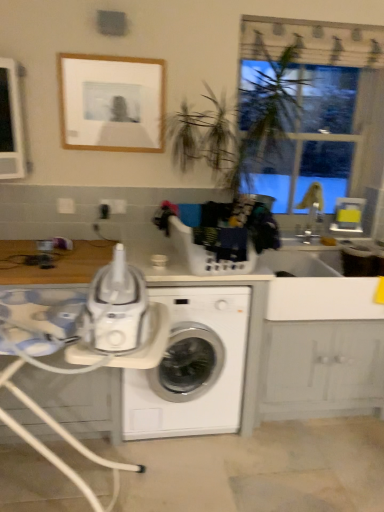
Locate an element on the screen. white plastic tray at center is located at coordinates (258, 352).

What do you see at coordinates (111, 103) in the screenshot? I see `wooden frame at upper center` at bounding box center [111, 103].

Locate an element on the screen. This screenshot has width=384, height=512. white plastic tray at center is located at coordinates (258, 352).

Who is smaller, white glossy washing machine at center or transparent plastic window screen at upper right?

Smaller between the two is transparent plastic window screen at upper right.

Which is more to the left, white glossy washing machine at center or transparent plastic window screen at upper right?

Positioned to the left is white glossy washing machine at center.

Which is correct: white glossy washing machine at center is inside transparent plastic window screen at upper right, or outside of it?

white glossy washing machine at center lies outside transparent plastic window screen at upper right.

In terms of width, does white glossy washing machine at center look wider or thinner when compared to transparent plastic window screen at upper right?

white glossy washing machine at center is wider than transparent plastic window screen at upper right.

Is wooden frame at upper center at the left side of white plastic tray at center?

Correct, you'll find wooden frame at upper center to the left of white plastic tray at center.

From a real-world perspective, which object rests below the other?

white plastic tray at center, from a real-world perspective.

Considering the positions of points (143, 137) and (136, 369), is point (143, 137) farther from camera compared to point (136, 369)?

Yes, point (143, 137) is farther from viewer.

Does wooden frame at upper center come in front of white plastic tray at center?

No.

From the image's perspective, is white plastic table at lower left above wooden frame at upper center?

Actually, white plastic table at lower left appears below wooden frame at upper center in the image.

How distant is white plastic table at lower left from wooden frame at upper center?

white plastic table at lower left and wooden frame at upper center are 1.37 meters apart.

Which object is wider, white plastic table at lower left or wooden frame at upper center?

With larger width is white plastic table at lower left.

Is white plastic table at lower left surrounding wooden frame at upper center?

No, wooden frame at upper center is not inside white plastic table at lower left.

Locate an element on the screen. This screenshot has height=512, width=384. window screen that appears on the right of wooden frame at upper center is located at coordinates (314, 140).

Is transparent plastic window screen at upper right with wooden frame at upper center?

No.

From the image's perspective, relative to wooden frame at upper center, is transparent plastic window screen at upper right above or below?

transparent plastic window screen at upper right is situated lower than wooden frame at upper center in the image.

Considering the relative positions of transparent plastic window screen at upper right and wooden frame at upper center in the image provided, is transparent plastic window screen at upper right behind wooden frame at upper center?

Yes, the depth of transparent plastic window screen at upper right is greater than that of wooden frame at upper center.

Considering the positions of points (163, 392) and (23, 358), is point (163, 392) closer to camera compared to point (23, 358)?

No, it is not.

Is white plastic tray at center shorter than white plastic table at lower left?

Yes, white plastic tray at center is shorter than white plastic table at lower left.

You are a GUI agent. You are given a task and a screenshot of the screen. Output one action in this format:
    pyautogui.click(x=<x>, y=<y>)
    Task: Click on the counter top below the white plastic table at lower left (from a real-world perspective)
    
    Given the screenshot: What is the action you would take?
    pyautogui.click(x=258, y=352)

How many degrees apart are the facing directions of white plastic tray at center and white plastic table at lower left?

The angular difference between white plastic tray at center and white plastic table at lower left is 5.69 degrees.

Is white plastic tray at center taller than wooden frame at upper center?

Yes.

Is white plastic tray at center surrounding wooden frame at upper center?

No, wooden frame at upper center is not surrounded by white plastic tray at center.

Is white plastic tray at center to the right of wooden frame at upper center from the viewer's perspective?

Correct, you'll find white plastic tray at center to the right of wooden frame at upper center.

Is white plastic tray at center oriented towards wooden frame at upper center?

No, white plastic tray at center is not facing towards wooden frame at upper center.

In the image, is wooden frame at upper center positioned in front of or behind white plastic table at lower left?

Visually, wooden frame at upper center is located behind white plastic table at lower left.

Does wooden frame at upper center appear on the left side of white plastic table at lower left?

In fact, wooden frame at upper center is to the right of white plastic table at lower left.

Is wooden frame at upper center far away from white plastic table at lower left?

Yes, wooden frame at upper center and white plastic table at lower left are quite far apart.

Considering the sizes of objects wooden frame at upper center and white plastic table at lower left in the image provided, who is taller, wooden frame at upper center or white plastic table at lower left?

With more height is white plastic table at lower left.

The image size is (384, 512). I want to click on window screen above the white glossy washing machine at center (from the image's perspective), so (314, 140).

Identify the location of picture frame behind the white plastic tray at center. The image size is (384, 512). (111, 103).

Based on their spatial positions, is transparent plastic window screen at upper right or white plastic tray at center closer to white plastic table at lower left?

white plastic tray at center is positioned closer to the anchor white plastic table at lower left.

Looking at the image, which one is located further to transparent plastic window screen at upper right, white plastic tray at center or white glossy washing machine at center?

white glossy washing machine at center is further to transparent plastic window screen at upper right.

Estimate the real-world distances between objects in this image. Which object is further from white glossy washing machine at center, transparent plastic window screen at upper right or white plastic table at lower left?

The object further to white glossy washing machine at center is transparent plastic window screen at upper right.

From the image, which object appears to be farther from white plastic table at lower left, white plastic tray at center or transparent plastic window screen at upper right?

Based on the image, transparent plastic window screen at upper right appears to be further to white plastic table at lower left.

Which object lies nearer to the anchor point white glossy washing machine at center, white plastic tray at center or white plastic table at lower left?

white plastic tray at center lies closer to white glossy washing machine at center than the other object.

When comparing their distances from white plastic tray at center, does wooden frame at upper center or white plastic table at lower left seem closer?

white plastic table at lower left.

Based on the photo, considering their positions, is transparent plastic window screen at upper right positioned further to white plastic table at lower left than white glossy washing machine at center?

transparent plastic window screen at upper right.

Considering their positions, is wooden frame at upper center positioned further to white plastic table at lower left than white glossy washing machine at center?

wooden frame at upper center is positioned further to the anchor white plastic table at lower left.

I want to click on window screen between wooden frame at upper center and white plastic tray at center from top to bottom, so click(x=314, y=140).

Where is `counter top that lies between transparent plastic window screen at upper right and white plastic table at lower left from top to bottom`? counter top that lies between transparent plastic window screen at upper right and white plastic table at lower left from top to bottom is located at coordinates (258, 352).

This screenshot has height=512, width=384. I want to click on window screen between wooden frame at upper center and white plastic table at lower left vertically, so click(314, 140).

Locate an element on the screen. counter top between white plastic table at lower left and white glossy washing machine at center from front to back is located at coordinates (258, 352).